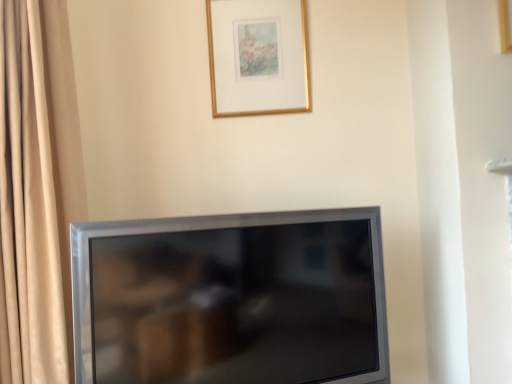
Question: From a real-world perspective, is satin silver tv at lower center physically located above or below gold metallic picture frame at upper center?

Choices:
 (A) below
 (B) above

Answer: (A)

Question: Considering their positions, is satin silver tv at lower center located in front of or behind gold metallic picture frame at upper center?

Choices:
 (A) behind
 (B) front

Answer: (B)

Question: Looking at the image, does satin silver tv at lower center seem bigger or smaller compared to gold metallic picture frame at upper center?

Choices:
 (A) small
 (B) big

Answer: (B)

Question: In terms of width, does gold metallic picture frame at upper center look wider or thinner when compared to satin silver tv at lower center?

Choices:
 (A) wide
 (B) thin

Answer: (B)

Question: Considering their positions, is gold metallic picture frame at upper center located in front of or behind satin silver tv at lower center?

Choices:
 (A) front
 (B) behind

Answer: (B)

Question: In the image, is gold metallic picture frame at upper center on the left side or the right side of satin silver tv at lower center?

Choices:
 (A) left
 (B) right

Answer: (B)

Question: From the image's perspective, is gold metallic picture frame at upper center located above or below satin silver tv at lower center?

Choices:
 (A) below
 (B) above

Answer: (B)